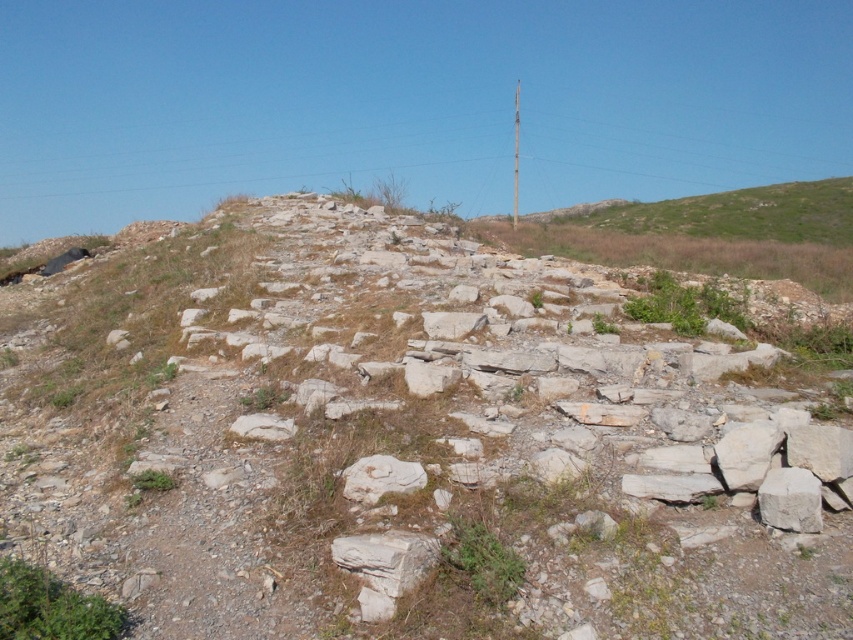
Who is more distant from viewer, (9, 566) or (502, 572)?

Point (502, 572)

Between green leafy grass at lower left and green grassy at center, which one is positioned higher?

green grassy at center

Is point (4, 609) farther from viewer compared to point (473, 524)?

No, it is not.

What are the coordinates of `green leafy grass at lower left` in the screenshot? It's located at (51, 605).

Is point (297, 205) less distant than point (22, 602)?

No, (297, 205) is further to viewer.

This screenshot has width=853, height=640. Identify the location of gray stone rubble at center. (407, 440).

Is gray stone rubble at center shorter than green grassy at center?

Incorrect, gray stone rubble at center's height does not fall short of green grassy at center's.

Does gray stone rubble at center appear on the left side of green grassy at center?

Correct, you'll find gray stone rubble at center to the left of green grassy at center.

Does point (566, 307) come farther from viewer compared to point (520, 563)?

Yes, point (566, 307) is behind point (520, 563).

You are a GUI agent. You are given a task and a screenshot of the screen. Output one action in this format:
    pyautogui.click(x=<x>, y=<y>)
    Task: Click on the gray stone rubble at center
    
    Given the screenshot: What is the action you would take?
    pyautogui.click(x=407, y=440)